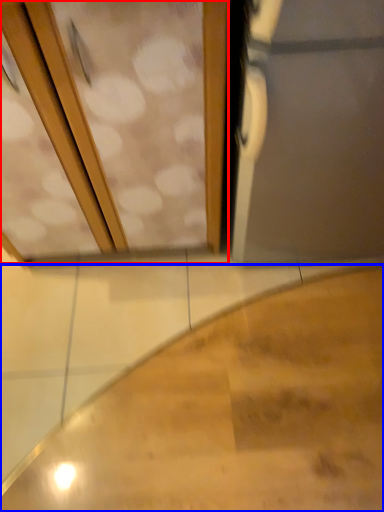
Question: Which object is closer to the camera taking this photo, screen door (highlighted by a red box) or stairs (highlighted by a blue box)?

Choices:
 (A) screen door
 (B) stairs

Answer: (A)